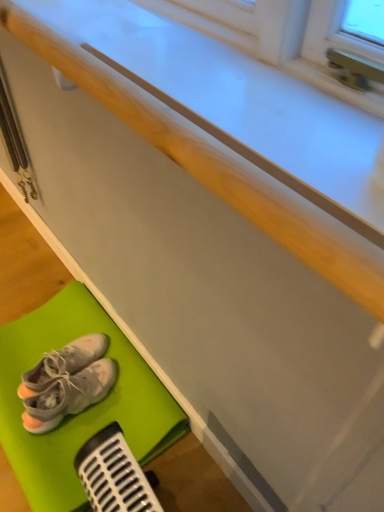
Locate an element on the screen. This screenshot has width=384, height=512. white fabric sneakers at lower left, placed as the 2th footwear when sorted from bottom to top is located at coordinates (63, 362).

Based on the photo, what is the approximate width of green rubber bath mat at lower left?

green rubber bath mat at lower left is 17.30 inches in width.

Where is `white fabric sneakers at lower left, placed as the 2th footwear when sorted from bottom to top`? white fabric sneakers at lower left, placed as the 2th footwear when sorted from bottom to top is located at coordinates (63, 362).

From the image's perspective, would you say white fabric sneakers at lower left, which appears as the 1th footwear when ordered from the bottom, is positioned over white fabric sneakers at lower left, which appears as the 1th footwear when viewed from the top?

Incorrect, from the image's perspective, white fabric sneakers at lower left, which appears as the 1th footwear when ordered from the bottom, is lower than white fabric sneakers at lower left, which appears as the 1th footwear when viewed from the top.

Is the position of white fabric sneakers at lower left, which appears as the second footwear when viewed from the top, more distant than that of white fabric sneakers at lower left, placed as the 2th footwear when sorted from bottom to top?

No, white fabric sneakers at lower left, which appears as the second footwear when viewed from the top, is closer to the camera.

Is white fabric sneakers at lower left, which appears as the 1th footwear when ordered from the bottom, inside the boundaries of white fabric sneakers at lower left, placed as the 2th footwear when sorted from bottom to top, or outside?

white fabric sneakers at lower left, which appears as the 1th footwear when ordered from the bottom, is spatially situated outside white fabric sneakers at lower left, placed as the 2th footwear when sorted from bottom to top.

From the image's perspective, is matte white counter top at center located beneath white fabric sneakers at lower left, which appears as the second footwear when viewed from the top?

No, from the image's perspective, matte white counter top at center is not beneath white fabric sneakers at lower left, which appears as the second footwear when viewed from the top.

Which is behind, point (148, 40) or point (86, 375)?

The point (86, 375) is farther.

Would you say matte white counter top at center is outside white fabric sneakers at lower left, which appears as the 1th footwear when ordered from the bottom?

Yes, matte white counter top at center is outside of white fabric sneakers at lower left, which appears as the 1th footwear when ordered from the bottom.

Is matte white counter top at center looking in the opposite direction of white fabric sneakers at lower left, which appears as the 1th footwear when ordered from the bottom?

No, matte white counter top at center's orientation is not away from white fabric sneakers at lower left, which appears as the 1th footwear when ordered from the bottom.

Are white fabric sneakers at lower left, which appears as the 1th footwear when viewed from the top, and white fabric sneakers at lower left, which appears as the 1th footwear when ordered from the bottom, beside each other?

Yes, white fabric sneakers at lower left, which appears as the 1th footwear when viewed from the top, is next to white fabric sneakers at lower left, which appears as the 1th footwear when ordered from the bottom.

Does white fabric sneakers at lower left, which appears as the 1th footwear when viewed from the top, appear on the right side of white fabric sneakers at lower left, which appears as the 1th footwear when ordered from the bottom?

No.

Measure the distance between white fabric sneakers at lower left, placed as the 2th footwear when sorted from bottom to top, and white fabric sneakers at lower left, which appears as the 1th footwear when ordered from the bottom.

2.09 inches.

Between point (59, 364) and point (44, 399), which one is positioned behind?

Point (59, 364)

Based on the photo, is green rubber bath mat at lower left facing away from matte white counter top at center?

green rubber bath mat at lower left is not turned away from matte white counter top at center.

Which is in front, green rubber bath mat at lower left or matte white counter top at center?

matte white counter top at center.

Between green rubber bath mat at lower left and matte white counter top at center, which one appears on the right side from the viewer's perspective?

Positioned to the right is matte white counter top at center.

From the image's perspective, is green rubber bath mat at lower left below matte white counter top at center?

Yes.

Considering the sizes of objects green rubber bath mat at lower left and white fabric sneakers at lower left, which appears as the second footwear when viewed from the top, in the image provided, who is taller, green rubber bath mat at lower left or white fabric sneakers at lower left, which appears as the second footwear when viewed from the top,?

white fabric sneakers at lower left, which appears as the second footwear when viewed from the top.

Is green rubber bath mat at lower left facing away from white fabric sneakers at lower left, which appears as the second footwear when viewed from the top?

green rubber bath mat at lower left does not have its back to white fabric sneakers at lower left, which appears as the second footwear when viewed from the top.

In the scene shown: Can we say green rubber bath mat at lower left lies outside white fabric sneakers at lower left, which appears as the second footwear when viewed from the top?

Indeed, green rubber bath mat at lower left is completely outside white fabric sneakers at lower left, which appears as the second footwear when viewed from the top.

Considering the relative positions of green rubber bath mat at lower left and white fabric sneakers at lower left, which appears as the 1th footwear when ordered from the bottom, in the image provided, is green rubber bath mat at lower left in front of white fabric sneakers at lower left, which appears as the 1th footwear when ordered from the bottom,?

Yes, it is in front of white fabric sneakers at lower left, which appears as the 1th footwear when ordered from the bottom.

Between white fabric sneakers at lower left, placed as the 2th footwear when sorted from bottom to top, and matte white counter top at center, which one is positioned behind?

white fabric sneakers at lower left, placed as the 2th footwear when sorted from bottom to top, is further away from the camera.

From the image's perspective, would you say white fabric sneakers at lower left, which appears as the 1th footwear when viewed from the top, is positioned over matte white counter top at center?

No, from the image's perspective, white fabric sneakers at lower left, which appears as the 1th footwear when viewed from the top, is not on top of matte white counter top at center.

Choose the correct answer: Is white fabric sneakers at lower left, placed as the 2th footwear when sorted from bottom to top, inside matte white counter top at center or outside it?

white fabric sneakers at lower left, placed as the 2th footwear when sorted from bottom to top, is outside matte white counter top at center.

Considering the sizes of objects white fabric sneakers at lower left, which appears as the 1th footwear when ordered from the bottom, and green rubber bath mat at lower left in the image provided, who is shorter, white fabric sneakers at lower left, which appears as the 1th footwear when ordered from the bottom, or green rubber bath mat at lower left?

green rubber bath mat at lower left.

Which object is thinner, white fabric sneakers at lower left, which appears as the 1th footwear when ordered from the bottom, or green rubber bath mat at lower left?

Thinner between the two is white fabric sneakers at lower left, which appears as the 1th footwear when ordered from the bottom.

What's the angular difference between white fabric sneakers at lower left, which appears as the second footwear when viewed from the top, and green rubber bath mat at lower left's facing directions?

7.15 degrees separate the facing orientations of white fabric sneakers at lower left, which appears as the second footwear when viewed from the top, and green rubber bath mat at lower left.

Is white fabric sneakers at lower left, which appears as the second footwear when viewed from the top, turned away from green rubber bath mat at lower left?

No, white fabric sneakers at lower left, which appears as the second footwear when viewed from the top, is not facing the opposite direction of green rubber bath mat at lower left.

Where is `footwear lying below the white fabric sneakers at lower left, placed as the 2th footwear when sorted from bottom to top (from the image's perspective)`? The image size is (384, 512). footwear lying below the white fabric sneakers at lower left, placed as the 2th footwear when sorted from bottom to top (from the image's perspective) is located at coordinates (69, 396).

Image resolution: width=384 pixels, height=512 pixels. I want to click on the 1st footwear behind the matte white counter top at center, so click(x=69, y=396).

Considering their positions, is matte white counter top at center positioned closer to white fabric sneakers at lower left, placed as the 2th footwear when sorted from bottom to top, than green rubber bath mat at lower left?

green rubber bath mat at lower left is positioned closer to the anchor white fabric sneakers at lower left, placed as the 2th footwear when sorted from bottom to top.

From the image, which object appears to be nearer to green rubber bath mat at lower left, matte white counter top at center or white fabric sneakers at lower left, which appears as the 1th footwear when viewed from the top?

Based on the image, white fabric sneakers at lower left, which appears as the 1th footwear when viewed from the top, appears to be nearer to green rubber bath mat at lower left.

Estimate the real-world distances between objects in this image. Which object is further from white fabric sneakers at lower left, which appears as the second footwear when viewed from the top, white fabric sneakers at lower left, placed as the 2th footwear when sorted from bottom to top, or green rubber bath mat at lower left?

Based on the image, green rubber bath mat at lower left appears to be further to white fabric sneakers at lower left, which appears as the second footwear when viewed from the top.

From the image, which object appears to be nearer to matte white counter top at center, white fabric sneakers at lower left, which appears as the 1th footwear when viewed from the top, or green rubber bath mat at lower left?

green rubber bath mat at lower left lies closer to matte white counter top at center than the other object.

Based on the photo, estimate the real-world distances between objects in this image. Which object is further from green rubber bath mat at lower left, white fabric sneakers at lower left, which appears as the 1th footwear when viewed from the top, or white fabric sneakers at lower left, which appears as the second footwear when viewed from the top?

white fabric sneakers at lower left, which appears as the 1th footwear when viewed from the top, is further to green rubber bath mat at lower left.

Looking at the image, which one is located further to white fabric sneakers at lower left, which appears as the 1th footwear when viewed from the top, matte white counter top at center or white fabric sneakers at lower left, which appears as the 1th footwear when ordered from the bottom?

matte white counter top at center is further to white fabric sneakers at lower left, which appears as the 1th footwear when viewed from the top.

Based on their spatial positions, is white fabric sneakers at lower left, which appears as the 1th footwear when ordered from the bottom, or green rubber bath mat at lower left closer to matte white counter top at center?

green rubber bath mat at lower left lies closer to matte white counter top at center than the other object.

When comparing their distances from white fabric sneakers at lower left, placed as the 2th footwear when sorted from bottom to top, does green rubber bath mat at lower left or matte white counter top at center seem closer?

Among the two, green rubber bath mat at lower left is located nearer to white fabric sneakers at lower left, placed as the 2th footwear when sorted from bottom to top.

The width and height of the screenshot is (384, 512). Identify the location of bath mat located between matte white counter top at center and white fabric sneakers at lower left, which appears as the 1th footwear when viewed from the top, in the depth direction. (84, 410).

Where is `bath mat between matte white counter top at center and white fabric sneakers at lower left, which appears as the second footwear when viewed from the top, in the front-back direction`? The image size is (384, 512). bath mat between matte white counter top at center and white fabric sneakers at lower left, which appears as the second footwear when viewed from the top, in the front-back direction is located at coordinates (84, 410).

The width and height of the screenshot is (384, 512). In order to click on footwear located between matte white counter top at center and white fabric sneakers at lower left, which appears as the 1th footwear when viewed from the top, in the depth direction in this screenshot , I will do `click(69, 396)`.

Identify the location of footwear between green rubber bath mat at lower left and white fabric sneakers at lower left, which appears as the 1th footwear when viewed from the top, from front to back. The image size is (384, 512). (69, 396).